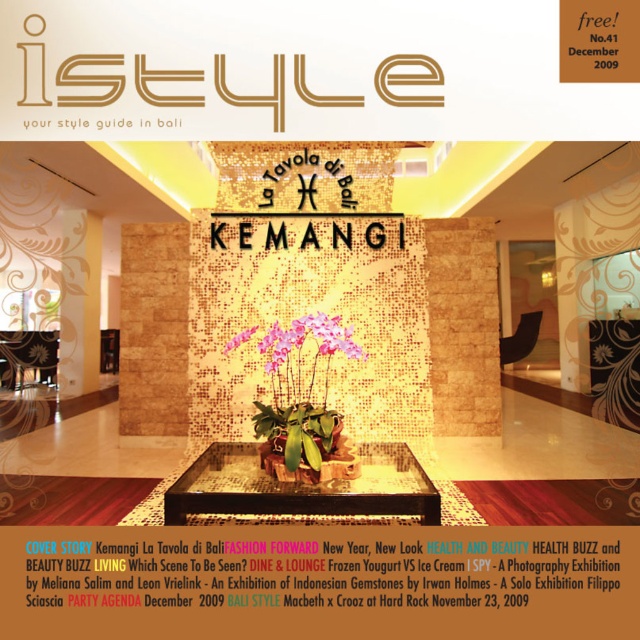
You are a photographer setting up a shoot in the magazine cover scene. You need to place a small camera tripod between the black mosaic table at center and the pink matte orchid at center. Based on their positions, where should you position the tripod?

The black mosaic table at center is located below the pink matte orchid at center, so you should place the tripod between them either above the table and below the orchid or between their horizontal positions depending on their alignment.

You are standing in the lobby and want to touch both the matte gold mosaic wall at center and the black mosaic table at center. Which object should you reach for first?

You should reach for the matte gold mosaic wall at center first because it is closer to you than the black mosaic table at center.

You are a florist who needs to place a pink matte orchid at center in a way that it is exactly 1.5 meters away from the matte gold mosaic wall at center. Can you position it correctly based on the current setup?

The current distance between the matte gold mosaic wall at center and the pink matte orchid at center is 1.41 meters, which is slightly less than the required 1.5 meters. To meet the requirement, the orchid needs to be moved approximately 0.09 meters further away from the wall.